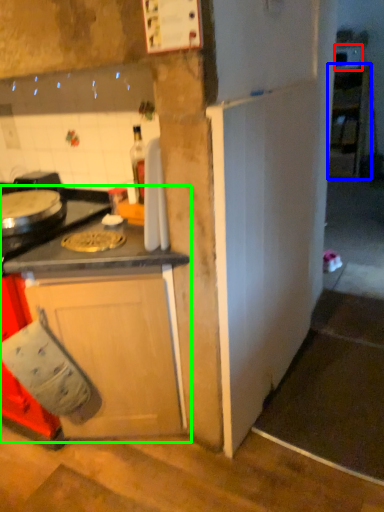
Question: Estimate the real-world distances between objects in this image. Which object is closer to appliance (highlighted by a red box), cabinetry (highlighted by a blue box) or cabinetry (highlighted by a green box)?

Choices:
 (A) cabinetry
 (B) cabinetry

Answer: (A)